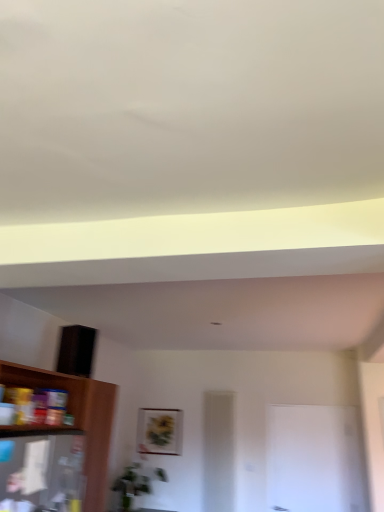
Question: Is white glossy door at center further to camera compared to matte gold picture frame at center?

Choices:
 (A) no
 (B) yes

Answer: (A)

Question: Does white glossy door at center turn towards matte gold picture frame at center?

Choices:
 (A) yes
 (B) no

Answer: (B)

Question: Is matte gold picture frame at center at the back of white glossy door at center?

Choices:
 (A) no
 (B) yes

Answer: (A)

Question: From the image's perspective, does white glossy door at center appear higher than matte gold picture frame at center?

Choices:
 (A) yes
 (B) no

Answer: (B)

Question: Is white glossy door at center to the right of matte gold picture frame at center from the viewer's perspective?

Choices:
 (A) yes
 (B) no

Answer: (A)

Question: Is white glossy door at center not inside matte gold picture frame at center?

Choices:
 (A) yes
 (B) no

Answer: (A)

Question: Is matte gold picture frame at center at the right side of white glossy door at center?

Choices:
 (A) no
 (B) yes

Answer: (A)

Question: Are matte gold picture frame at center and white glossy door at center located far from each other?

Choices:
 (A) yes
 (B) no

Answer: (A)

Question: Does matte gold picture frame at center have a smaller size compared to white glossy door at center?

Choices:
 (A) yes
 (B) no

Answer: (A)

Question: Is matte gold picture frame at center taller than white glossy door at center?

Choices:
 (A) no
 (B) yes

Answer: (A)

Question: From the image's perspective, is matte gold picture frame at center beneath white glossy door at center?

Choices:
 (A) yes
 (B) no

Answer: (B)

Question: From the image's perspective, is matte gold picture frame at center over white glossy door at center?

Choices:
 (A) yes
 (B) no

Answer: (A)

Question: Is matte gold picture frame at center thinner than wooden shelf at lower left?

Choices:
 (A) yes
 (B) no

Answer: (A)